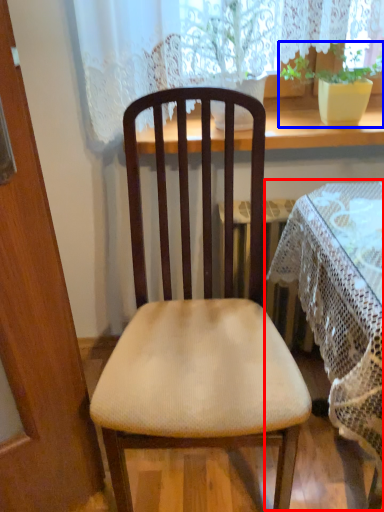
Question: Which point is closer to the camera, table (highlighted by a red box) or houseplant (highlighted by a blue box)?

Choices:
 (A) table
 (B) houseplant

Answer: (A)